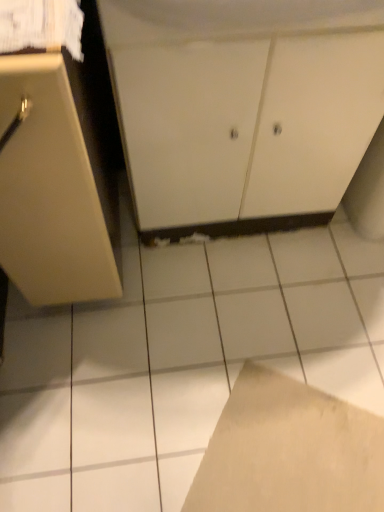
The height and width of the screenshot is (512, 384). Find the location of `empty space that is ontop of white glossy tile at center (from a real-world perspective)`. empty space that is ontop of white glossy tile at center (from a real-world perspective) is located at coordinates (230, 347).